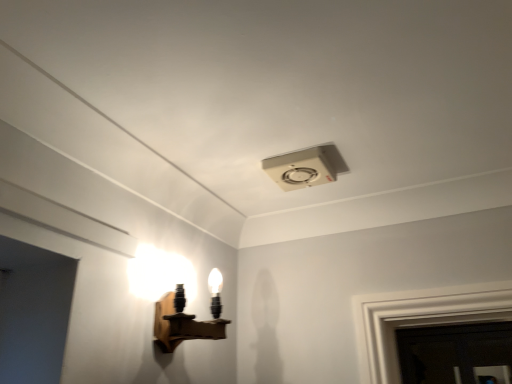
Question: Is white plastic ceiling fan at upper center, which is the first lamp from top to bottom, wider or thinner than dark glass door at lower right?

Choices:
 (A) thin
 (B) wide

Answer: (B)

Question: Is white plastic ceiling fan at upper center, which is the first lamp from top to bottom, to the left or to the right of dark glass door at lower right in the image?

Choices:
 (A) right
 (B) left

Answer: (B)

Question: Estimate the real-world distances between objects in this image. Which object is farther from the white plastic ceiling fan at upper center, which is the 2th lamp in left-to-right order?

Choices:
 (A) wooden wall sconce at left, the 1th lamp when ordered from bottom to top
 (B) dark glass door at lower right

Answer: (B)

Question: Which is nearer to the wooden wall sconce at left, the 1th lamp when ordered from bottom to top?

Choices:
 (A) dark glass door at lower right
 (B) white plastic ceiling fan at upper center, the second lamp when ordered from bottom to top

Answer: (B)